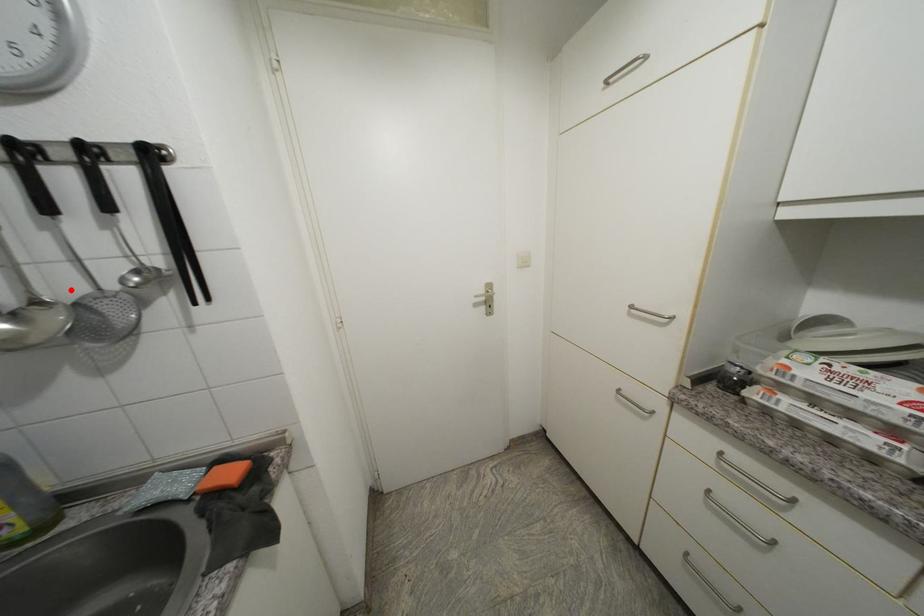
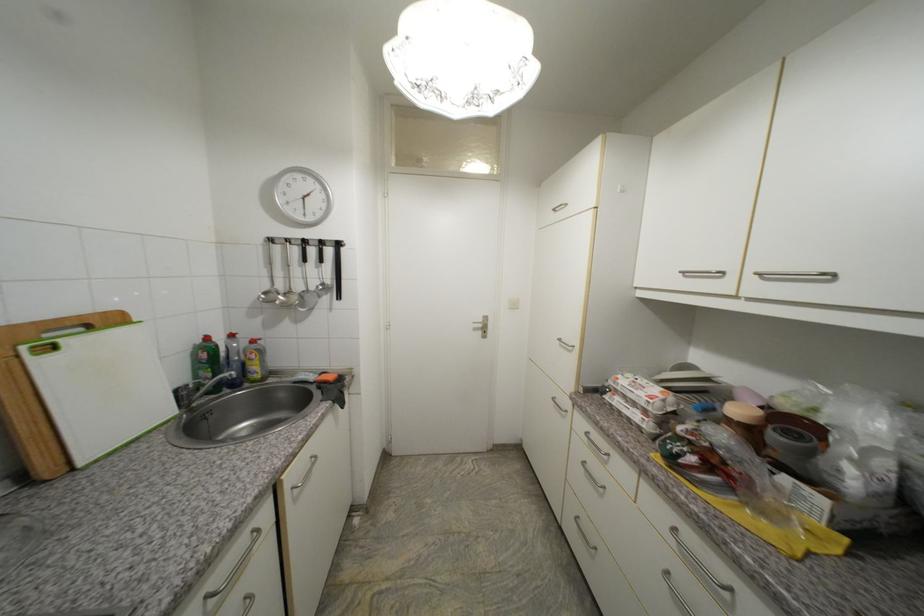
Question: I am providing you with two images of the same scene from different viewpoints. A red point is marked on the first image. Is the red point's position out of view in image 2?

Choices:
 (A) Yes
 (B) No

Answer: (B)